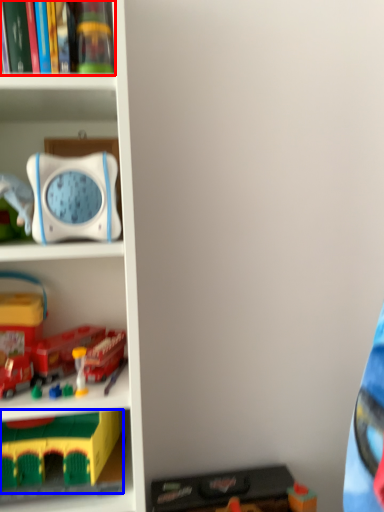
Question: Which object appears closest to the camera in this image, book (highlighted by a red box) or toy (highlighted by a blue box)?

Choices:
 (A) book
 (B) toy

Answer: (A)